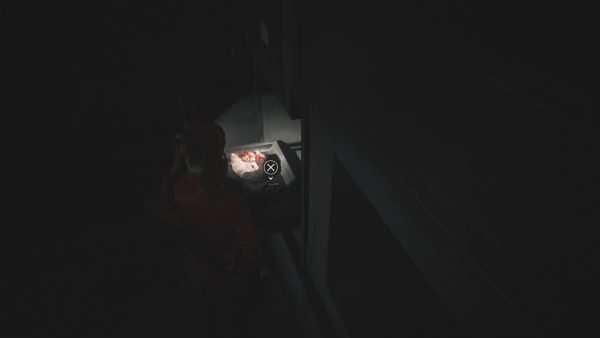
Find the location of `window shade`. window shade is located at coordinates (242, 122).